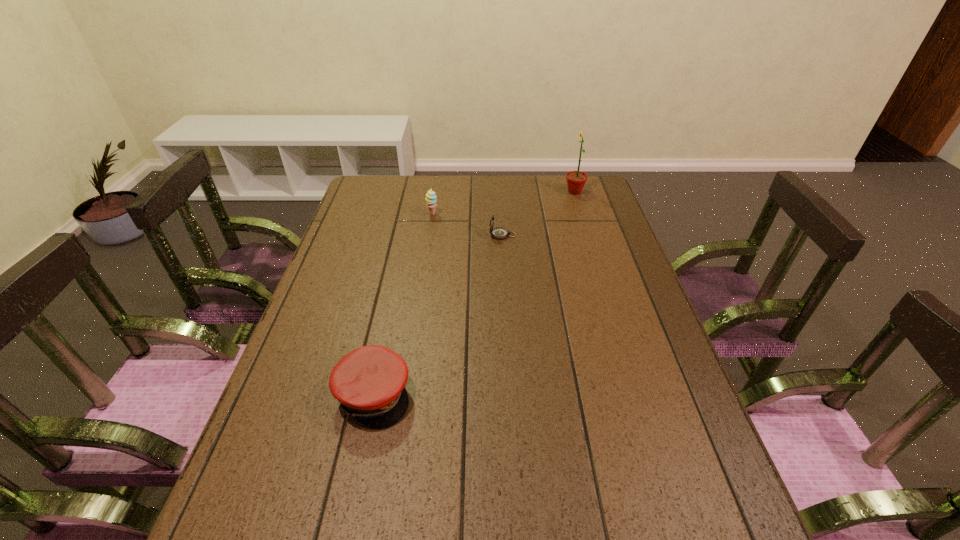
Where is `vacant region between the second tallest object and the compass`? This screenshot has height=540, width=960. vacant region between the second tallest object and the compass is located at coordinates (468, 225).

I want to click on vacant area that lies between the sunflower and the second nearest object, so click(539, 213).

Find the location of a particular element. The image size is (960, 540). vacant area that lies between the third farthest object and the tallest object is located at coordinates (539, 213).

Locate an element on the screen. The image size is (960, 540). vacant space that is in between the compass and the rightmost object is located at coordinates (539, 213).

Choose which object is the nearest neighbor to the tallest object. Please provide its 2D coordinates. Your answer should be formatted as a tuple, i.e. [(x, y)], where the tuple contains the x and y coordinates of a point satisfying the conditions above.

[(499, 233)]

You are a GUI agent. You are given a task and a screenshot of the screen. Output one action in this format:
    pyautogui.click(x=<x>, y=<y>)
    Task: Click on the third closest object to the farthest object
    The height and width of the screenshot is (540, 960).
    Given the screenshot: What is the action you would take?
    pyautogui.click(x=369, y=382)

Locate an element on the screen. The height and width of the screenshot is (540, 960). free space that satisfies the following two spatial constraints: 1. on the front side of the second farthest object; 2. on the front-facing side of the nearest object is located at coordinates (405, 395).